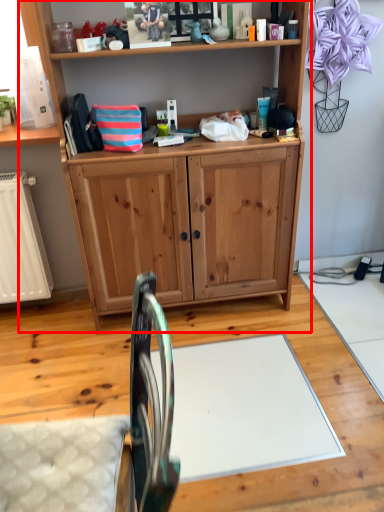
Question: From the image's perspective, what is the correct spatial positioning of vanity (annotated by the red box) in reference to swivel chair?

Choices:
 (A) below
 (B) above

Answer: (B)